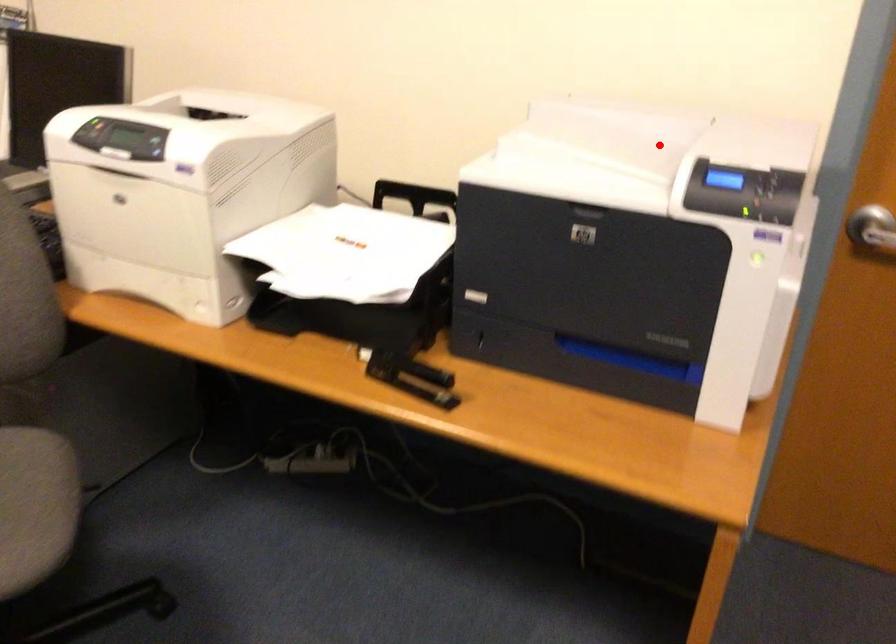
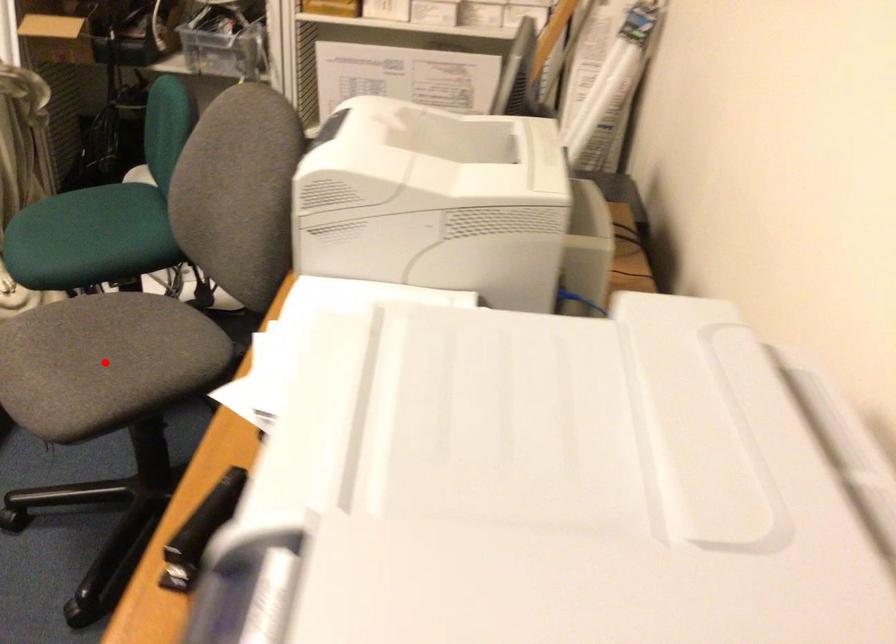
I am providing you with two images of the same scene from different viewpoints. A red point is marked on the first image and another point is marked on the second image. Is the red point in image1 aligned with the point shown in image2?

No